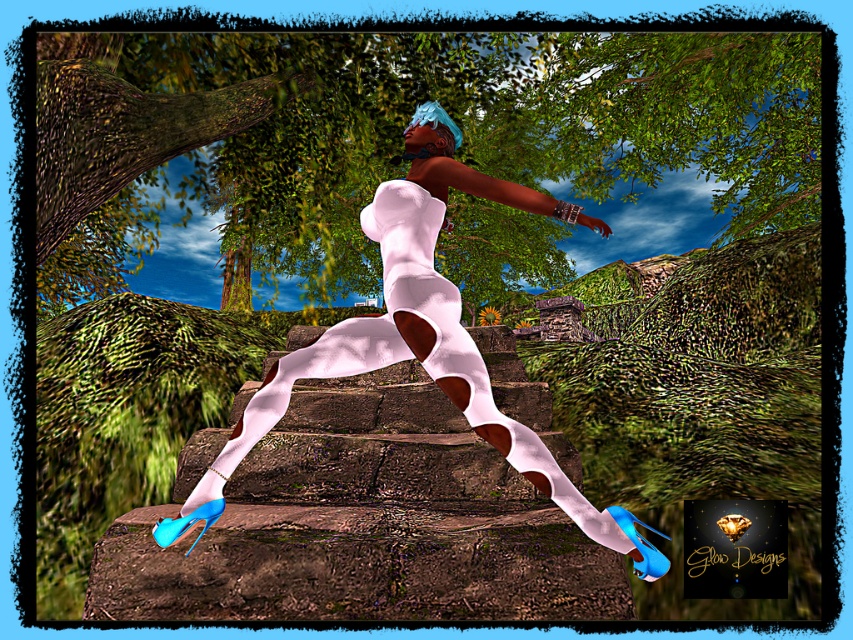
In the scene shown: You are an interior designer planning to place a large potted plant in the scene. Considering the green leafy tree at upper center and the white matte leggings at center, which object has a wider spread or size in the image?

The green leafy tree at upper center has a larger width compared to the white matte leggings at center, making it the wider object in the scene.

You are a photographer setting up a shoot in a garden. You have a green leafy tree at upper center and white matte leggings at center in your frame. Which object is positioned to the left side of the other?

The green leafy tree at upper center is to the left of white matte leggings at center.

Based on the scene description, which object is taller between the green leafy tree at upper center and the white matte leggings at center?

The green leafy tree at upper center is much taller than the white matte leggings at center.